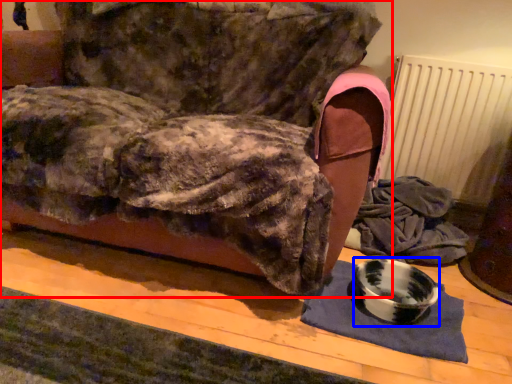
Question: Which object appears farthest to the camera in this image, furniture (highlighted by a red box) or bowl (highlighted by a blue box)?

Choices:
 (A) furniture
 (B) bowl

Answer: (B)